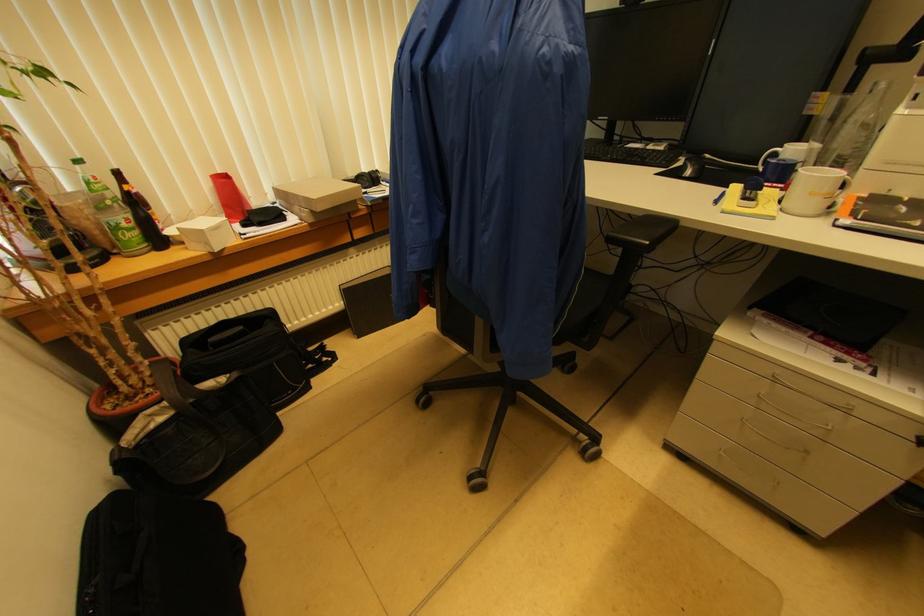
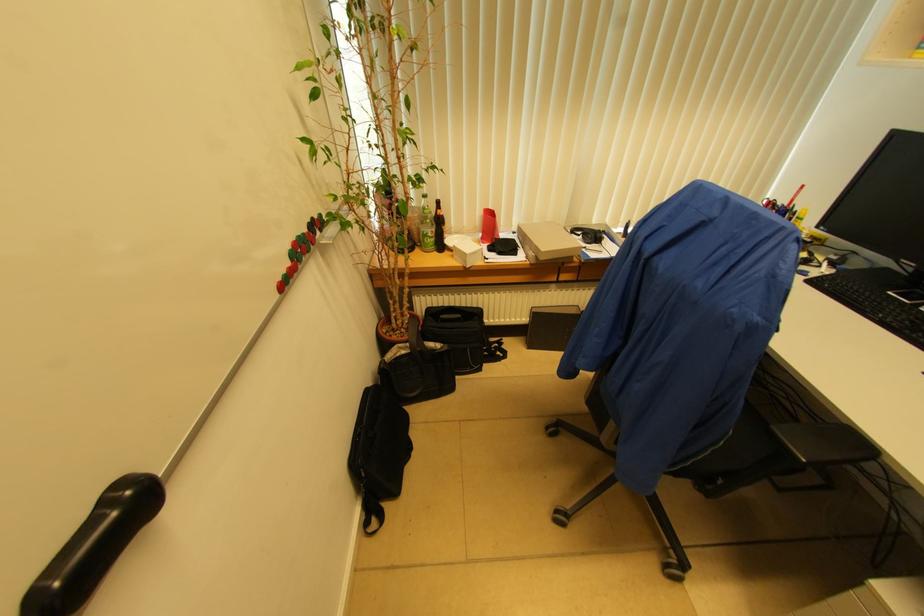
The point at (315, 200) is marked in the first image. Where is the corresponding point in the second image?

(543, 252)